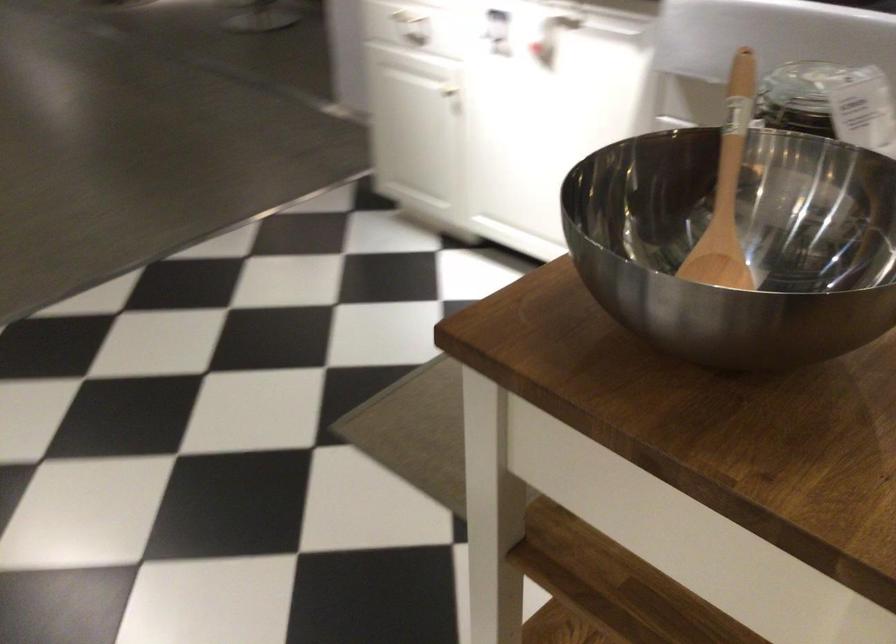
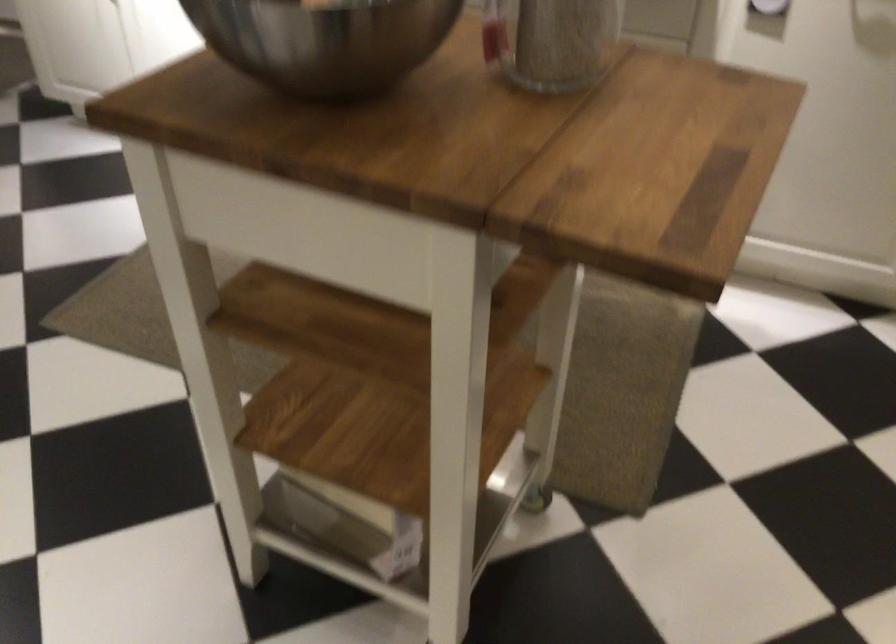
Question: The first image is from the beginning of the video and the second image is from the end. How did the camera likely rotate when shooting the video?

Choices:
 (A) Left
 (B) Right
 (C) Up
 (D) Down

Answer: (B)